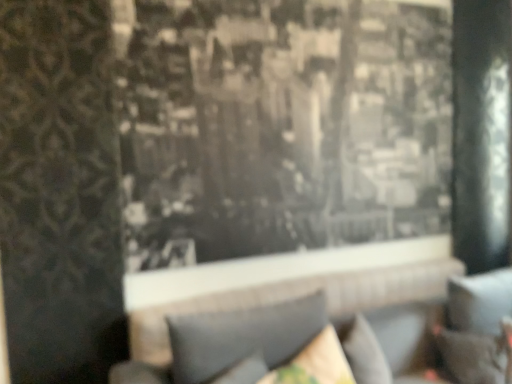
Question: Considering the positions of point (305, 337) and point (177, 375), is point (305, 337) closer or farther from the camera than point (177, 375)?

Choices:
 (A) closer
 (B) farther

Answer: (B)

Question: In terms of size, does gray fabric couch at center appear bigger or smaller than textured gray pillow at lower center, which is the 1th pillow from left to right?

Choices:
 (A) small
 (B) big

Answer: (B)

Question: Which object is positioned closest to the velvet dark brown pillow at lower right, which ranks as the first pillow in right-to-left order?

Choices:
 (A) black textured fabric at center
 (B) textured gray pillow at lower center, which is the 1th pillow from left to right
 (C) gray fabric couch at center
 (D) velvet beige pillow at lower center, arranged as the 2th pillow when viewed from the left

Answer: (C)

Question: Which is nearer to the black textured fabric at center?

Choices:
 (A) textured gray pillow at lower center, which is the 1th pillow from left to right
 (B) velvet dark brown pillow at lower right, the third pillow positioned from the left
 (C) gray fabric couch at center
 (D) velvet beige pillow at lower center, arranged as the 2th pillow when viewed from the left

Answer: (C)